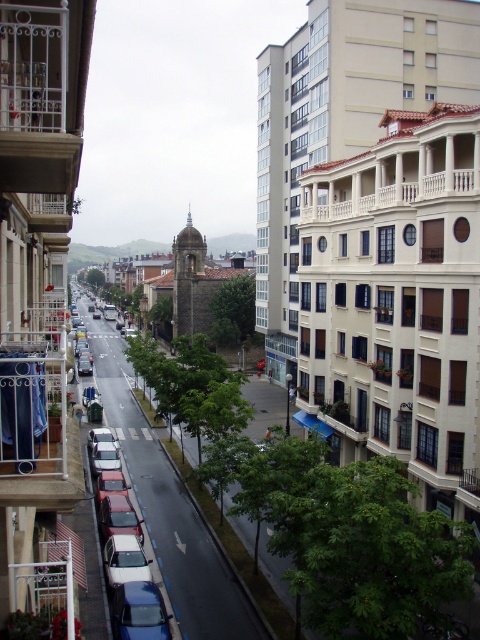
Question: Based on their relative distances, which object is farther from the stone tower at center?

Choices:
 (A) white metal balcony at left
 (B) metallic blue sedan at lower left

Answer: (A)

Question: Can you confirm if metallic blue sedan at lower left is positioned below stone tower at center?

Choices:
 (A) no
 (B) yes

Answer: (B)

Question: Can you confirm if white metal balcony at left is positioned above metallic blue sedan at lower left?

Choices:
 (A) no
 (B) yes

Answer: (B)

Question: Which object is closer to the camera taking this photo?

Choices:
 (A) white metal balcony at left
 (B) metallic blue sedan at lower left

Answer: (A)

Question: Which object is positioned farthest from the white metal balcony at left?

Choices:
 (A) stone tower at center
 (B) metallic blue sedan at lower left

Answer: (A)

Question: Is metallic blue sedan at lower left below stone tower at center?

Choices:
 (A) yes
 (B) no

Answer: (A)